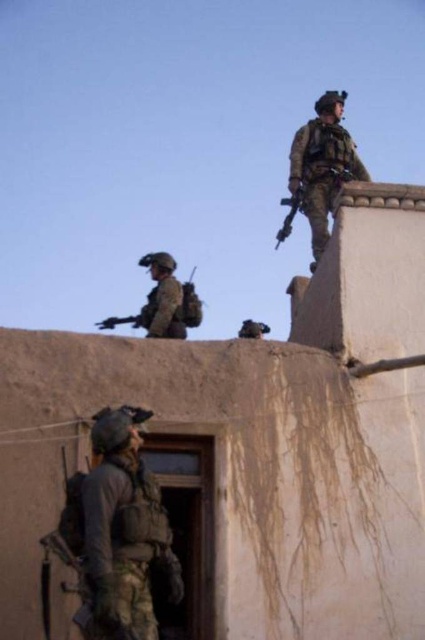
You are a military planner trying to set up a communication relay between the camouflage fabric uniform at lower left and the camera. The relay requires a direct line of sight and can transmit up to 120 feet. Will the relay work between these two points?

The camouflage fabric uniform at lower left and camera are 123.27 feet apart from each other. Since the maximum transmission distance is 120 feet, the relay will not work as the distance exceeds the limit.

You are a military analyst reviewing a surveillance image of a building. You see two soldiers wearing camouflage uniforms. One is labeled as the camouflage fabric uniform at lower left and the other as camouflage uniform at upper right. Which soldier is positioned closer to the edge of the building?

The camouflage fabric uniform at lower left is closer to the viewer than the camouflage uniform at upper right, so the camouflage fabric uniform at lower left is positioned closer to the edge of the building.

You are a drone operator observing the scene. You need to report the exact coordinates of the camouflage fabric uniform at lower left. What are its coordinates?

The camouflage fabric uniform at lower left is located at coordinates point (124,529).